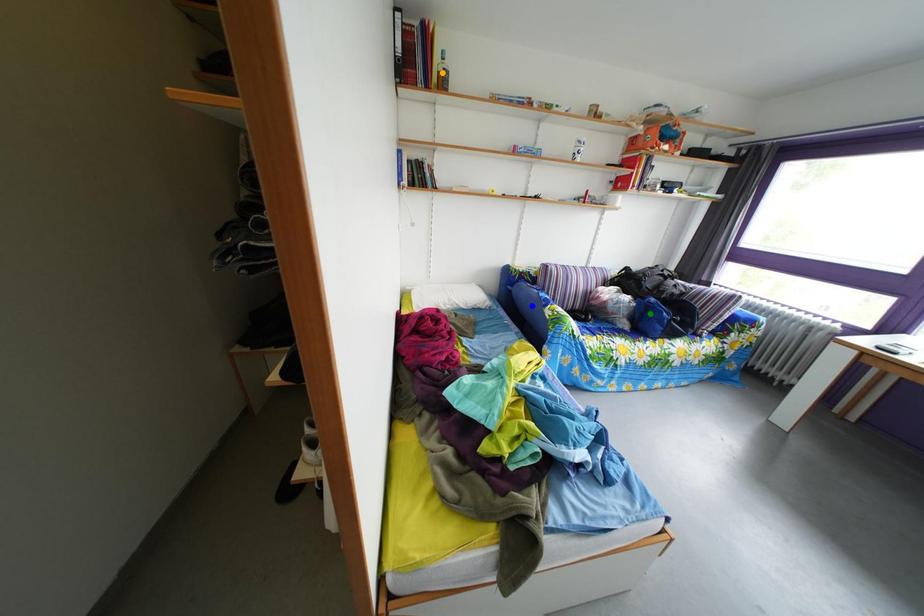
Order these from nearest to farthest:
blue point
orange point
green point

1. orange point
2. green point
3. blue point